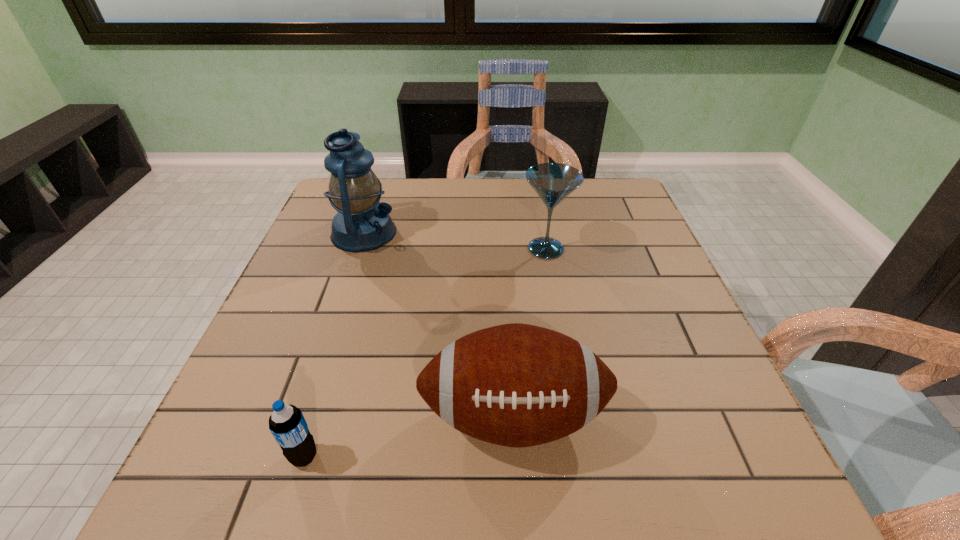
Where is `vacant space that satisfies the following two spatial constraints: 1. on the back side of the shortest object; 2. on the face of the tallest object`? vacant space that satisfies the following two spatial constraints: 1. on the back side of the shortest object; 2. on the face of the tallest object is located at coordinates (373, 233).

Where is `free space that satisfies the following two spatial constraints: 1. on the back side of the martini; 2. on the right side of the soda bottle`? This screenshot has width=960, height=540. free space that satisfies the following two spatial constraints: 1. on the back side of the martini; 2. on the right side of the soda bottle is located at coordinates (369, 249).

You are a GUI agent. You are given a task and a screenshot of the screen. Output one action in this format:
    pyautogui.click(x=<x>, y=<y>)
    Task: Click on the vacant space that satisfies the following two spatial constraints: 1. on the face of the shortest object; 2. on the left side of the tallest object
    This screenshot has width=960, height=540.
    Given the screenshot: What is the action you would take?
    pyautogui.click(x=287, y=456)

Where is `free location that satisfies the following two spatial constraints: 1. on the face of the shortest object; 2. on the left side of the lantern`? free location that satisfies the following two spatial constraints: 1. on the face of the shortest object; 2. on the left side of the lantern is located at coordinates (287, 456).